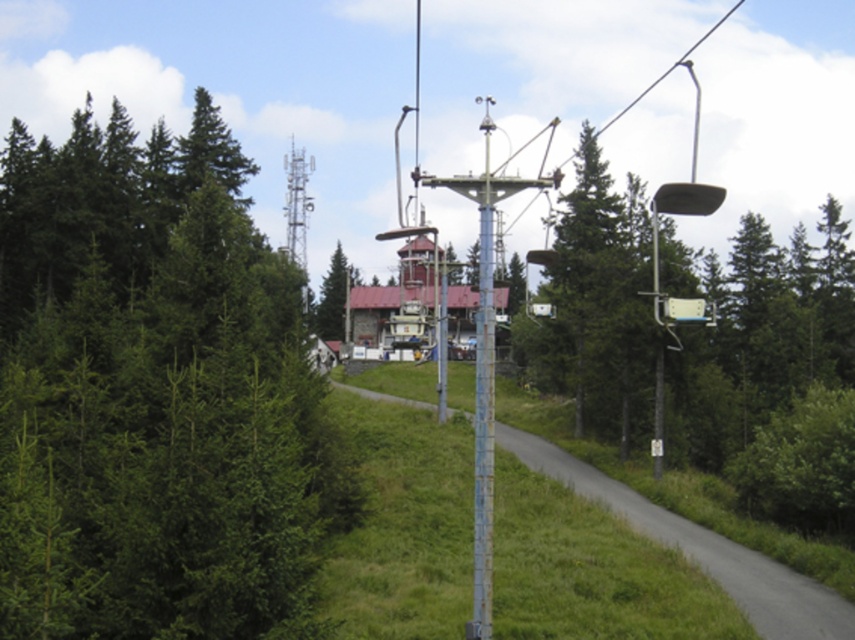
Can you confirm if rusty metal pole at center is positioned below green textured tree at center?

Actually, rusty metal pole at center is above green textured tree at center.

Between rusty metal pole at center and green textured tree at center, which one is positioned lower?

Positioned lower is green textured tree at center.

The image size is (855, 640). I want to click on rusty metal pole at center, so click(482, 397).

The image size is (855, 640). In order to click on rusty metal pole at center in this screenshot , I will do `click(482, 397)`.

Who is more distant from viewer, (264, 456) or (482, 196)?

Positioned behind is point (482, 196).

Is green matte tree at left smaller than rusty metal pole at center?

Yes, green matte tree at left is smaller than rusty metal pole at center.

The height and width of the screenshot is (640, 855). What are the coordinates of `green matte tree at left` in the screenshot? It's located at (154, 394).

Where is `green matte tree at left`? This screenshot has height=640, width=855. green matte tree at left is located at coordinates (154, 394).

Is point (122, 118) more distant than point (328, 296)?

No, (122, 118) is closer to viewer.

Which is behind, point (158, 561) or point (345, 298)?

Point (345, 298)

What do you see at coordinates (154, 394) in the screenshot? This screenshot has height=640, width=855. I see `green matte tree at left` at bounding box center [154, 394].

Where is `green matte tree at left`? This screenshot has height=640, width=855. green matte tree at left is located at coordinates (154, 394).